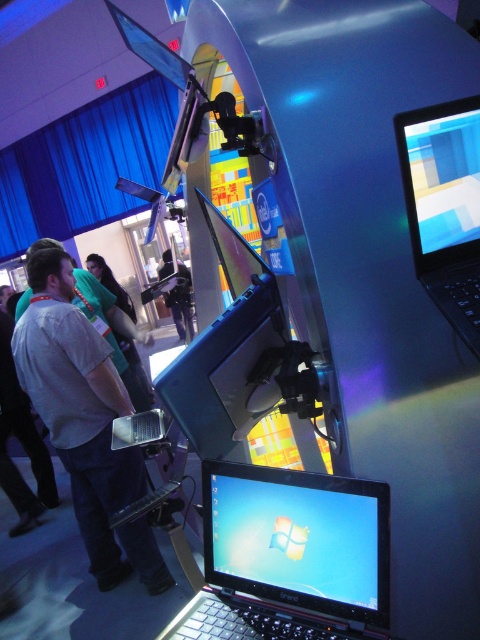
Question: Estimate the real-world distances between objects in this image. Which object is closer to the dark blue fabric jacket at center?

Choices:
 (A) matte black laptop at upper right
 (B) light gray shirt at center
 (C) black glossy laptop at center

Answer: (B)

Question: Is light gray shirt at center further to the viewer compared to matte black laptop at upper right?

Choices:
 (A) no
 (B) yes

Answer: (B)

Question: Among these points, which one is nearest to the camera?

Choices:
 (A) pyautogui.click(x=310, y=557)
 (B) pyautogui.click(x=168, y=257)

Answer: (A)

Question: Which point appears closest to the camera in this image?

Choices:
 (A) (152, 557)
 (B) (436, 152)

Answer: (B)

Question: Where is matte black laptop at upper right located in relation to dark blue fabric jacket at center in the image?

Choices:
 (A) below
 (B) above

Answer: (A)

Question: In this image, where is matte black laptop at upper right located relative to dark blue fabric jacket at center?

Choices:
 (A) below
 (B) above

Answer: (A)